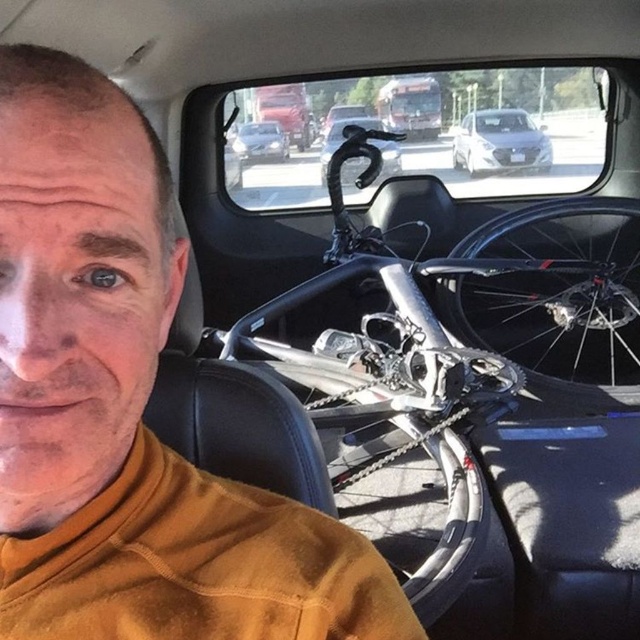
Question: Is white glossy sedan at upper center smaller than shiny black bicycle handlebar at center?

Choices:
 (A) no
 (B) yes

Answer: (B)

Question: Which point appears closest to the camera in this image?

Choices:
 (A) (52, 432)
 (B) (269, 124)
 (C) (624, 296)
 (D) (321, 173)

Answer: (A)

Question: Which of the following is the farthest from the observer?

Choices:
 (A) (561, 202)
 (B) (276, 125)
 (C) (496, 140)

Answer: (B)

Question: Which object is the closest to the matte silver sedan at center?

Choices:
 (A) white glossy sedan at upper center
 (B) brushed metal bus at upper center

Answer: (B)

Question: Does silver metallic bicycle at center appear on the right side of brushed metal bus at upper center?

Choices:
 (A) yes
 (B) no

Answer: (B)

Question: Is white glossy sedan at upper center further to camera compared to matte silver sedan at center?

Choices:
 (A) yes
 (B) no

Answer: (B)